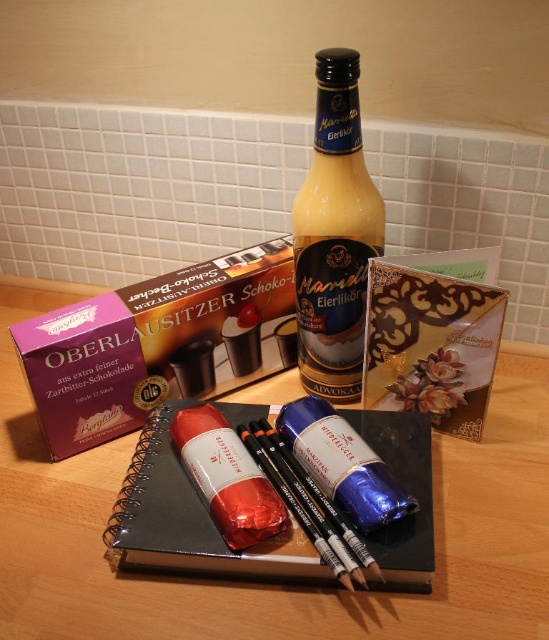
Question: Is purple cardboard box at upper left above black matte notebook at center?

Choices:
 (A) yes
 (B) no

Answer: (A)

Question: Is wooden table at center further to camera compared to yellow glass bottle at center?

Choices:
 (A) yes
 (B) no

Answer: (B)

Question: Which object appears closest to the camera in this image?

Choices:
 (A) black matte notebook at center
 (B) purple cardboard box at upper left

Answer: (A)

Question: Which object appears closest to the camera in this image?

Choices:
 (A) yellow glass bottle at center
 (B) purple cardboard box at upper left

Answer: (A)

Question: Does purple cardboard box at upper left appear over black matte notebook at center?

Choices:
 (A) yes
 (B) no

Answer: (A)

Question: Estimate the real-world distances between objects in this image. Which object is farther from the wooden table at center?

Choices:
 (A) purple cardboard box at upper left
 (B) yellow glass bottle at center
 (C) black matte notebook at center

Answer: (B)